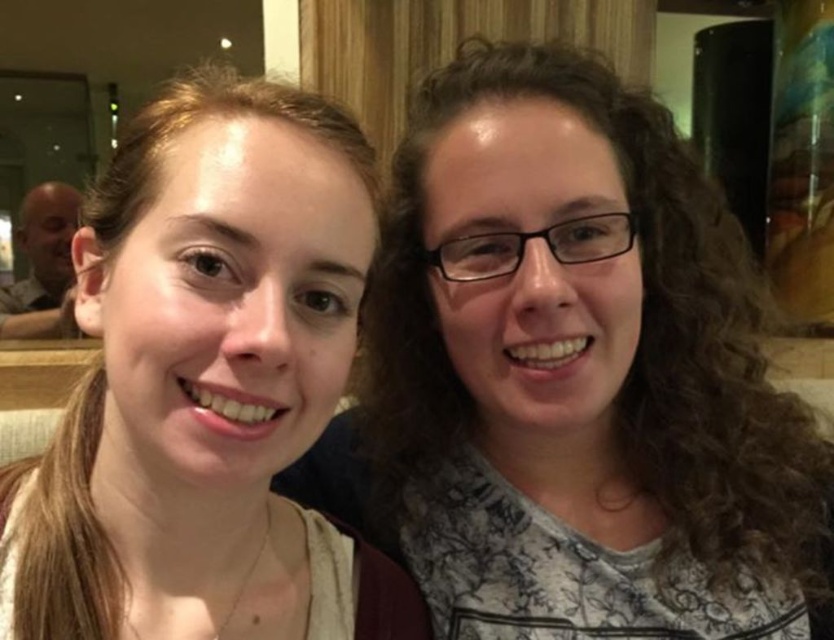
Does matte black hair at upper right come in front of matte brown hair at left?

No, it is behind matte brown hair at left.

Can you confirm if matte black hair at upper right is smaller than matte brown hair at left?

No, matte black hair at upper right is not smaller than matte brown hair at left.

Is point (483, 445) closer to viewer compared to point (162, 99)?

Yes, point (483, 445) is closer to viewer.

This screenshot has width=834, height=640. Identify the location of matte black hair at upper right. (571, 376).